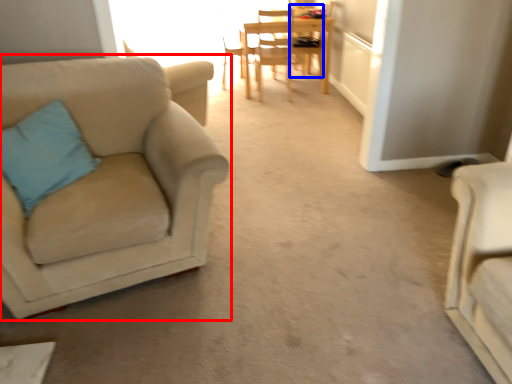
Question: Among these objects, which one is farthest to the camera, chair (highlighted by a red box) or chair (highlighted by a blue box)?

Choices:
 (A) chair
 (B) chair

Answer: (B)